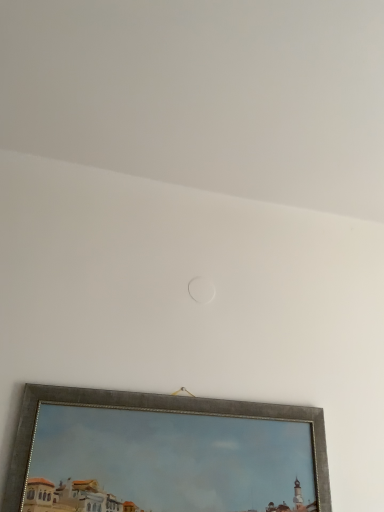
Find the location of a particular element. silver metallic picture frame at lower center is located at coordinates (164, 454).

This screenshot has width=384, height=512. What do you see at coordinates (164, 454) in the screenshot?
I see `silver metallic picture frame at lower center` at bounding box center [164, 454].

The width and height of the screenshot is (384, 512). I want to click on silver metallic picture frame at lower center, so click(164, 454).